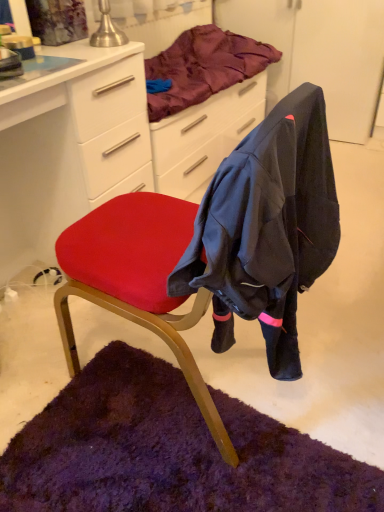
Question: Is point (231, 53) closer or farther from the camera than point (3, 119)?

Choices:
 (A) farther
 (B) closer

Answer: (A)

Question: From a real-world perspective, is satin purple blanket at upper center positioned above or below matte white desk at center?

Choices:
 (A) below
 (B) above

Answer: (B)

Question: Which of these objects is positioned farthest from the satin purple blanket at upper center?

Choices:
 (A) matte white desk at center
 (B) velvet red chair at center

Answer: (B)

Question: Based on their relative distances, which object is farther from the satin purple blanket at upper center?

Choices:
 (A) velvet red chair at center
 (B) matte white desk at center

Answer: (A)